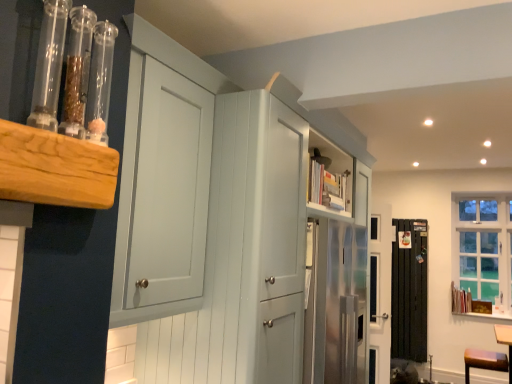
Question: Is clear glass window at upper right outside transparent glass tubes at upper left?

Choices:
 (A) no
 (B) yes

Answer: (B)

Question: Is transparent glass tubes at upper left at the back of clear glass window at upper right?

Choices:
 (A) yes
 (B) no

Answer: (B)

Question: From a real-world perspective, is clear glass window at upper right located higher than transparent glass tubes at upper left?

Choices:
 (A) yes
 (B) no

Answer: (B)

Question: Is clear glass window at upper right next to transparent glass tubes at upper left and touching it?

Choices:
 (A) no
 (B) yes

Answer: (A)

Question: Does clear glass window at upper right have a greater height compared to transparent glass tubes at upper left?

Choices:
 (A) yes
 (B) no

Answer: (A)

Question: From a real-world perspective, is clear glass window at upper right beneath transparent glass tubes at upper left?

Choices:
 (A) no
 (B) yes

Answer: (B)

Question: Does clear glass window at upper right have a smaller size compared to matte white cabinet at upper center?

Choices:
 (A) yes
 (B) no

Answer: (A)

Question: Considering the relative sizes of clear glass window at upper right and matte white cabinet at upper center in the image provided, is clear glass window at upper right bigger than matte white cabinet at upper center?

Choices:
 (A) no
 (B) yes

Answer: (A)

Question: From a real-world perspective, is clear glass window at upper right under matte white cabinet at upper center?

Choices:
 (A) yes
 (B) no

Answer: (B)

Question: Is clear glass window at upper right positioned far away from matte white cabinet at upper center?

Choices:
 (A) yes
 (B) no

Answer: (A)

Question: Does clear glass window at upper right come in front of matte white cabinet at upper center?

Choices:
 (A) yes
 (B) no

Answer: (B)

Question: From the image's perspective, is clear glass window at upper right below matte white cabinet at upper center?

Choices:
 (A) yes
 (B) no

Answer: (A)

Question: Can you confirm if matte white cabinet at upper center is thinner than black metal radiator at lower right?

Choices:
 (A) no
 (B) yes

Answer: (A)